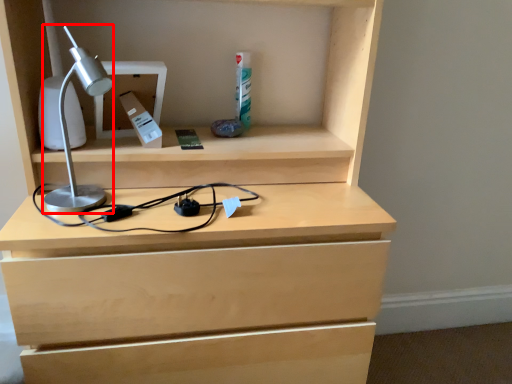
Question: Where is lamp (annotated by the red box) located in relation to cabinet in the image?

Choices:
 (A) left
 (B) right

Answer: (A)